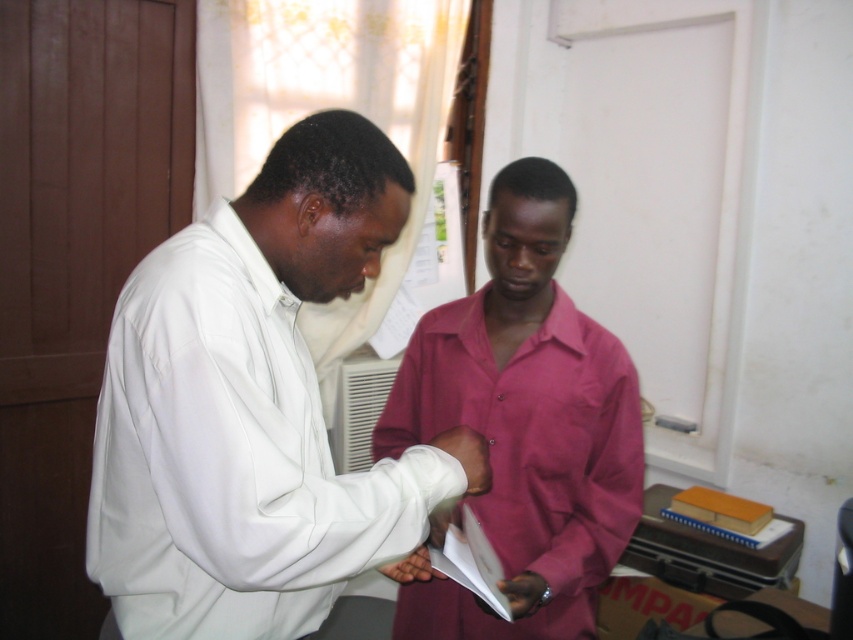
Question: Estimate the real-world distances between objects in this image. Which object is farther from the yellow matte folder at lower right?

Choices:
 (A) white paper at center
 (B) white smooth shirt at center
 (C) matte pink shirt at center

Answer: (B)

Question: In this image, where is white smooth shirt at center located relative to white paper at center?

Choices:
 (A) below
 (B) above

Answer: (B)

Question: Based on their relative distances, which object is nearer to the yellow matte folder at lower right?

Choices:
 (A) white smooth shirt at center
 (B) matte pink shirt at center

Answer: (B)

Question: Is white smooth shirt at center thinner than white paper at center?

Choices:
 (A) yes
 (B) no

Answer: (B)

Question: Can you confirm if white smooth shirt at center is positioned to the left of yellow matte folder at lower right?

Choices:
 (A) no
 (B) yes

Answer: (B)

Question: Which point is closer to the camera?

Choices:
 (A) (496, 588)
 (B) (573, 333)

Answer: (A)